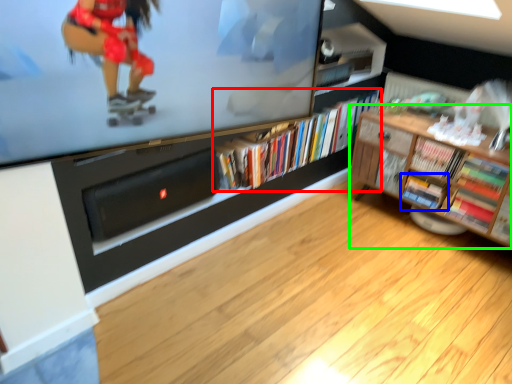
Question: Which object is the farthest from book (highlighted by a red box)? Choose among these: book (highlighted by a blue box) or shelf (highlighted by a green box).

Choices:
 (A) book
 (B) shelf

Answer: (A)